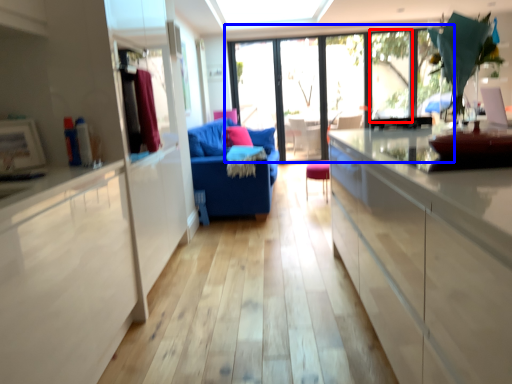
Question: Which point is closer to the camera, window (highlighted by a red box) or window (highlighted by a blue box)?

Choices:
 (A) window
 (B) window

Answer: (A)